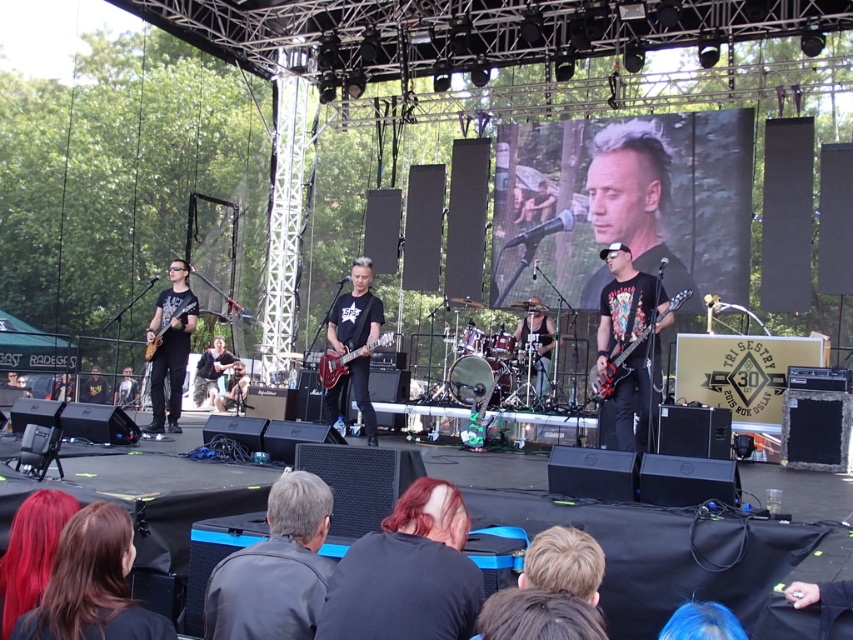
You are a photographer at the concert and want to capture a closeup of the dark brown hair at lower center and the gray fabric jacket at lower center. Which one is closer to the camera?

The dark brown hair at lower center is shorter than the gray fabric jacket at lower center, so it is closer to the camera.

You are a photographer at the concert. You need to capture a closeup shot of the musician with dark brown hair at lower center and the gray fabric jacket at lower center. Which part of the musician should you focus on to ensure both are in frame?

The dark brown hair at lower center might be wider than the gray fabric jacket at lower center, so you should focus on the wider area where the dark brown hair is located to ensure both are in frame.

You are a photographer trying to capture the best angle of the concert stage. You notice two points marked as point 1 and point 2 on the stage. Point 1 is at coordinate (392, 522) and point 2 is at (242, 611). Which point is closer to your camera position?

Point 1 at coordinate (392, 522) is closer to the camera because it is further to the viewer than point 2 at (242, 611).